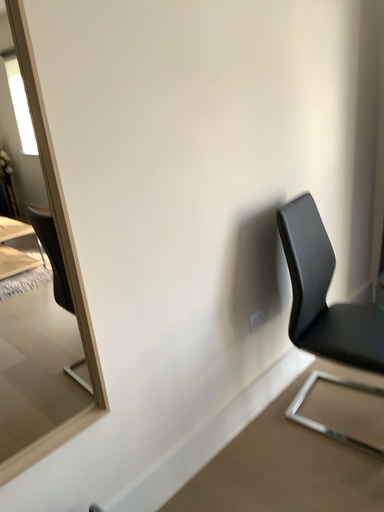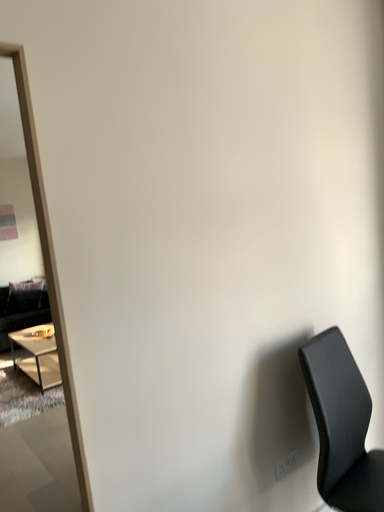
Question: Which way did the camera rotate in the video?

Choices:
 (A) rotated downward
 (B) rotated upward

Answer: (B)